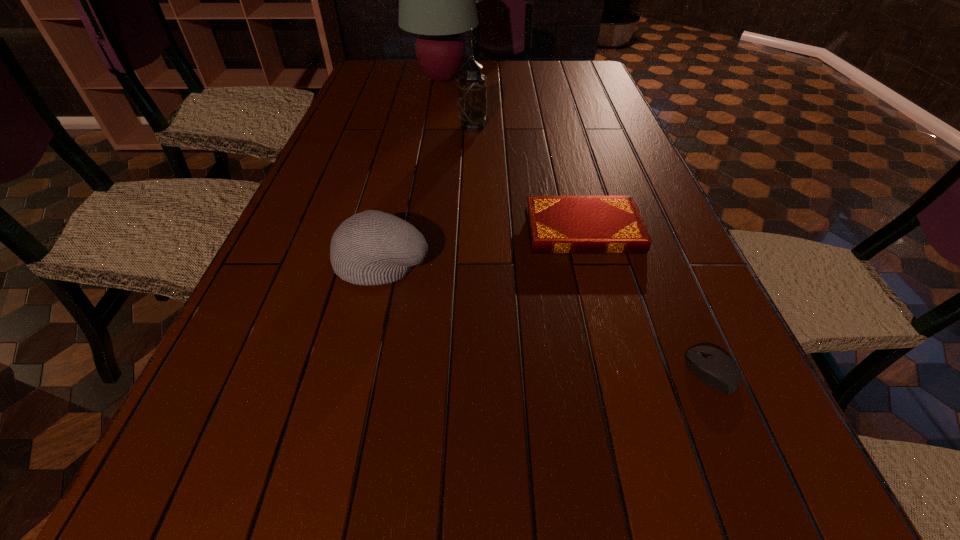
This screenshot has height=540, width=960. I want to click on lampshade, so click(437, 0).

I want to click on the farthest object, so click(x=437, y=0).

Locate an element on the screen. The image size is (960, 540). oil lamp is located at coordinates (472, 90).

I want to click on the second farthest object, so click(472, 90).

Where is `beanie`? beanie is located at coordinates (372, 247).

I want to click on hardback book, so click(x=556, y=224).

I want to click on the nearest object, so click(715, 368).

Locate an element on the screen. vacant area situated 0.350m on the front of the lampshade is located at coordinates (432, 143).

In order to click on vacant area situated on the back of the second tallest object in this screenshot , I will do `click(473, 103)`.

Locate an element on the screen. free location located on the left of the third shortest object is located at coordinates (268, 262).